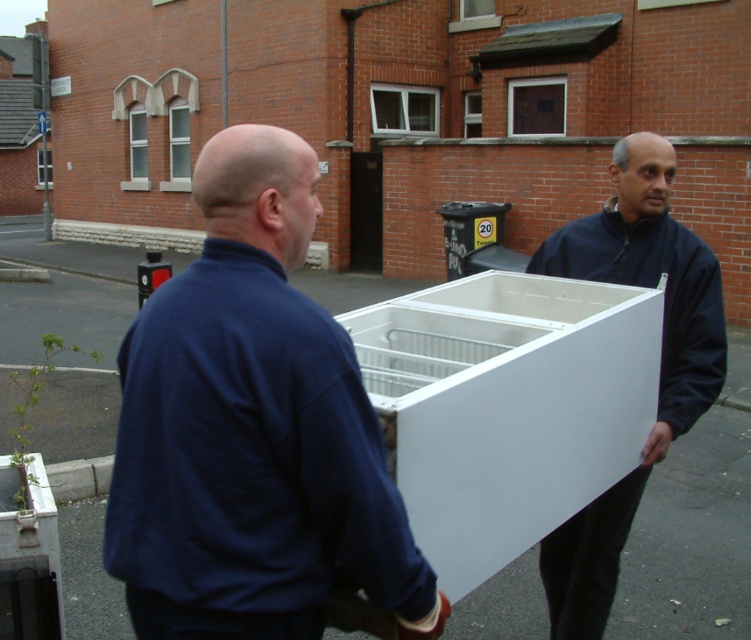
You are a delivery person who needs to place a matte white cabinet at right on the ground. However, there is a blue fabric jacket at center in the way. Can you move the jacket to make space?

The blue fabric jacket at center is located above the matte white cabinet at right, so moving the jacket would allow space to place the cabinet on the ground.

Looking at this image, you are a delivery person trying to fit the blue fabric jacket at center and the matte white cabinet at right into a truck. The truck has a loading area that is 1.8 meters wide. Can both items be placed side by side without exceeding the width?

The blue fabric jacket at center has a lesser width compared to matte white cabinet at right. However, without knowing the exact widths of both items, it is impossible to determine if their combined width exceeds 1.8 meters. More information is needed to confirm.

You are a delivery person who needs to deliver a package to the blue fabric jacket at center. Based on the coordinates provided, can you confirm if the blue fabric jacket at center is located at point (252, 429)?

Yes, the blue fabric jacket at center is located at point (252, 429) according to the coordinates provided.